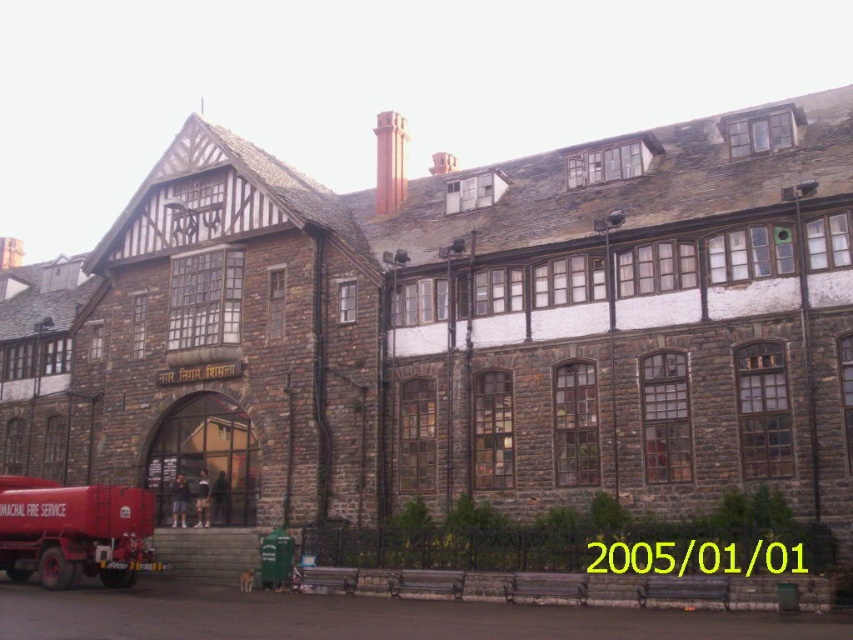
Looking at this image, you are a delivery person approaching the building from the front entrance. You need to park your matte red truck at lower left near the red brick chimney at upper center. Can you park the truck directly in front of the chimney?

The matte red truck at lower left is located below the red brick chimney at upper center, so it is positioned lower on the building. Since the chimney is on the upper part of the building, you cannot park the truck directly in front of it as the truck is already at the lower left and the chimney is above it.

You are standing in front of the historic building and notice two points marked on its facade. The first point is at coordinates point (115, 532) and the second is at point (387, 193). Which of these two points is closer to your current position?

Point (115, 532) is closer to the camera than point (387, 193), so the first point is closer to your current position.

You are standing in front of the historic building and notice a matte red truck at lower left and a red brick chimney at upper center. Which object is nearer to you?

The matte red truck at lower left is closer to the viewer than the red brick chimney at upper center.